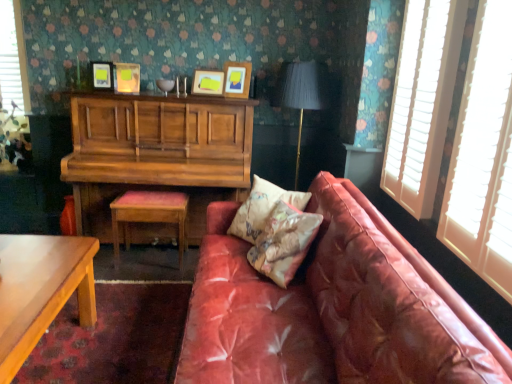
Question: Considering the relative sizes of matte wooden picture frame at upper center, marked as the 3th picture frame in a left-to-right arrangement, and matte yellow picture frame at upper center, positioned as the 4th picture frame in right-to-left order, in the image provided, is matte wooden picture frame at upper center, marked as the 3th picture frame in a left-to-right arrangement, taller than matte yellow picture frame at upper center, positioned as the 4th picture frame in right-to-left order,?

Choices:
 (A) no
 (B) yes

Answer: (A)

Question: From the image's perspective, does matte wooden picture frame at upper center, placed as the 2th picture frame when sorted from right to left, appear higher than matte yellow picture frame at upper center, the first picture frame from the left?

Choices:
 (A) yes
 (B) no

Answer: (B)

Question: Is matte wooden picture frame at upper center, placed as the 2th picture frame when sorted from right to left, positioned beyond the bounds of matte yellow picture frame at upper center, positioned as the 4th picture frame in right-to-left order?

Choices:
 (A) no
 (B) yes

Answer: (B)

Question: Is there a large distance between matte wooden picture frame at upper center, placed as the 2th picture frame when sorted from right to left, and matte yellow picture frame at upper center, positioned as the 4th picture frame in right-to-left order?

Choices:
 (A) no
 (B) yes

Answer: (A)

Question: Does matte wooden picture frame at upper center, placed as the 2th picture frame when sorted from right to left, have a lesser height compared to matte yellow picture frame at upper center, the first picture frame from the left?

Choices:
 (A) yes
 (B) no

Answer: (A)

Question: Is matte yellow picture frame at upper center, the first picture frame from the left, surrounded by matte wooden picture frame at upper center, placed as the 2th picture frame when sorted from right to left?

Choices:
 (A) no
 (B) yes

Answer: (A)

Question: Is smooth wooden table at lower left taller than wooden piano at upper left?

Choices:
 (A) no
 (B) yes

Answer: (A)

Question: From a real-world perspective, is smooth wooden table at lower left beneath wooden piano at upper left?

Choices:
 (A) yes
 (B) no

Answer: (A)

Question: Can you confirm if smooth wooden table at lower left is wider than wooden piano at upper left?

Choices:
 (A) yes
 (B) no

Answer: (B)

Question: Is there a large distance between smooth wooden table at lower left and wooden piano at upper left?

Choices:
 (A) yes
 (B) no

Answer: (A)

Question: Can you confirm if smooth wooden table at lower left is positioned to the right of wooden piano at upper left?

Choices:
 (A) no
 (B) yes

Answer: (A)

Question: Is the position of smooth wooden table at lower left more distant than that of wooden piano at upper left?

Choices:
 (A) no
 (B) yes

Answer: (A)

Question: Considering the relative sizes of matte black lampshade at center and matte wooden picture frame at upper center, placed as the 2th picture frame when sorted from right to left, in the image provided, is matte black lampshade at center smaller than matte wooden picture frame at upper center, placed as the 2th picture frame when sorted from right to left,?

Choices:
 (A) no
 (B) yes

Answer: (A)